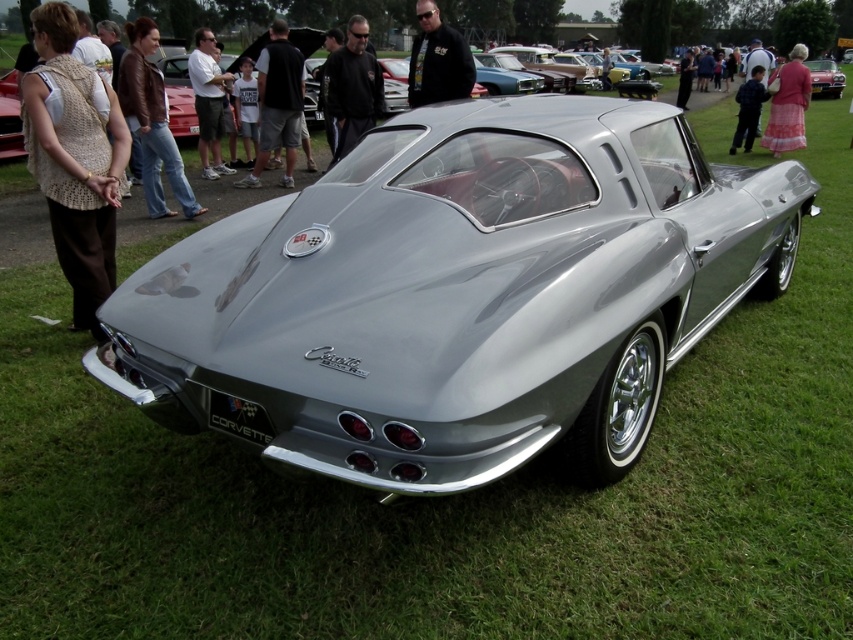
You are a photographer at a car show and you want to take a photo of the 1963 Chevrolet Corvette Sting Ray while also including the black leather jacket at center in the frame. The camera you have is 1.2 meters wide. Can you fit both the car and the jacket in the photo without moving either the camera or the car?

The black leather jacket at center and camera are 6.23 meters apart from each other. Since the camera is 1.2 meters wide, it can capture a wider angle to include both the car and the jacket within the 6.23 meter distance between them.

You are standing in front of the 1963 Chevrolet Corvette Sting Ray at the car show. You notice two points marked on the car. The first point is at coordinate point (270, 26) and the second is at point (462, 38). If you were to walk towards the car, which point would you encounter first?

Point (270, 26) is further to the viewer than point (462, 38), so you would encounter point (270, 26) first as you walk towards the car.

Where is the black leather jacket at center located in the image?

The black leather jacket at center is located at point (x=437, y=60) in the image.